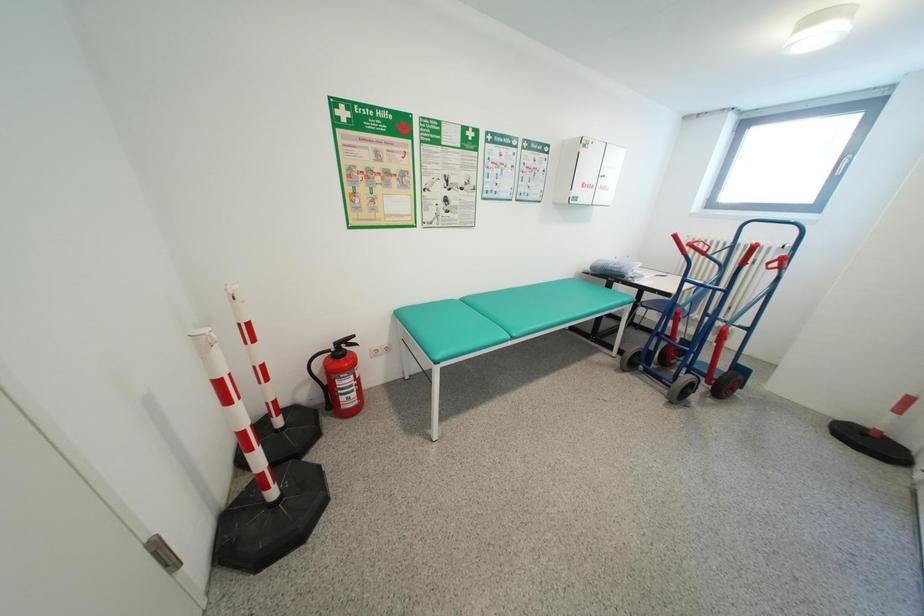
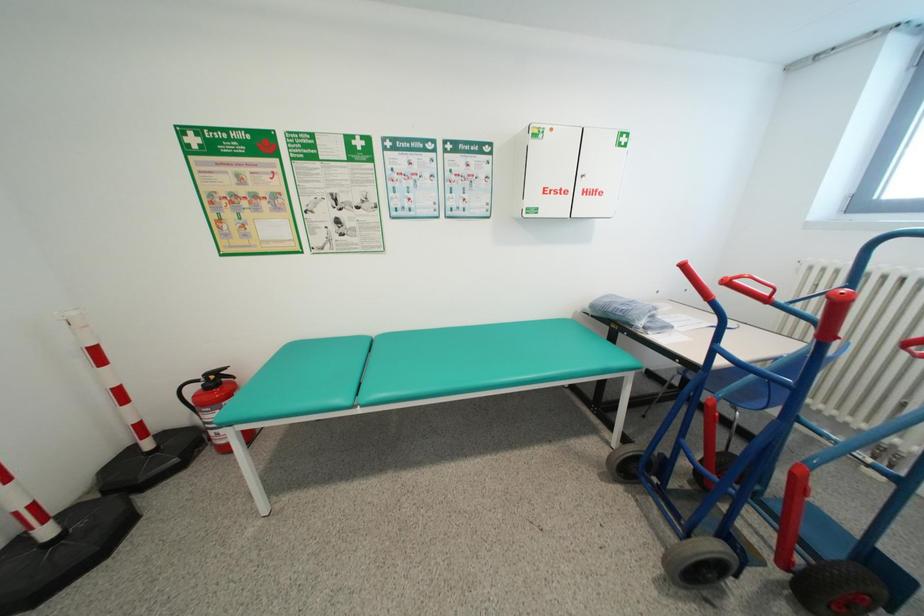
In a continuous first-person perspective shot, in which direction is the camera moving?

The cameraman walked toward right, forward.